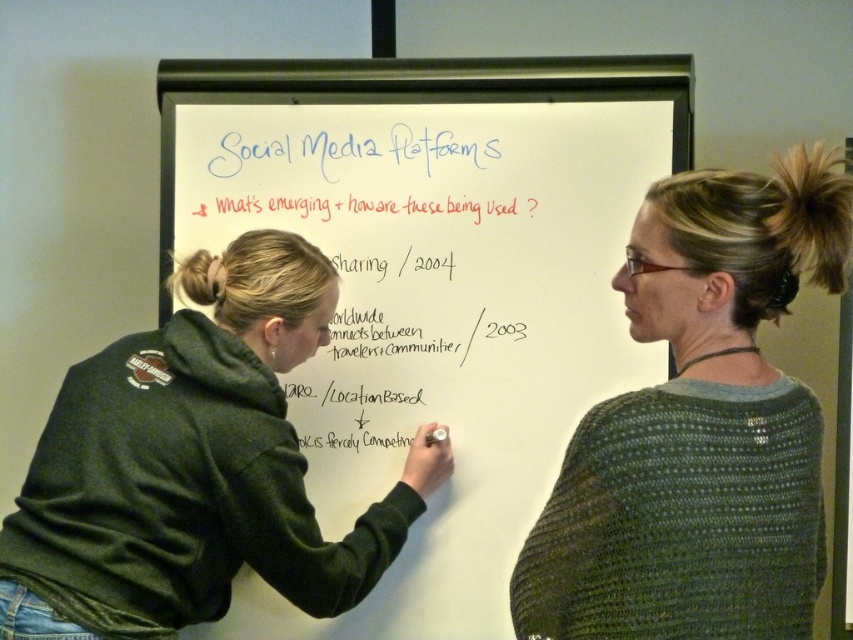
Who is taller, green knitted sweater at upper right or dark green hoodie at left?

dark green hoodie at left

Describe the element at coordinates (699, 428) in the screenshot. I see `green knitted sweater at upper right` at that location.

Identify the location of green knitted sweater at upper right. The width and height of the screenshot is (853, 640). (699, 428).

Is the position of whiteboard at center less distant than that of green knitted sweater at upper right?

No, it is not.

Between whiteboard at center and green knitted sweater at upper right, which one has less height?

With less height is green knitted sweater at upper right.

Identify the location of whiteboard at center. This screenshot has width=853, height=640. (432, 284).

Can you confirm if whiteboard at center is positioned to the right of dark green hoodie at left?

Correct, you'll find whiteboard at center to the right of dark green hoodie at left.

Consider the image. Who is positioned more to the left, whiteboard at center or dark green hoodie at left?

dark green hoodie at left

Locate an element on the screen. The image size is (853, 640). whiteboard at center is located at coordinates (432, 284).